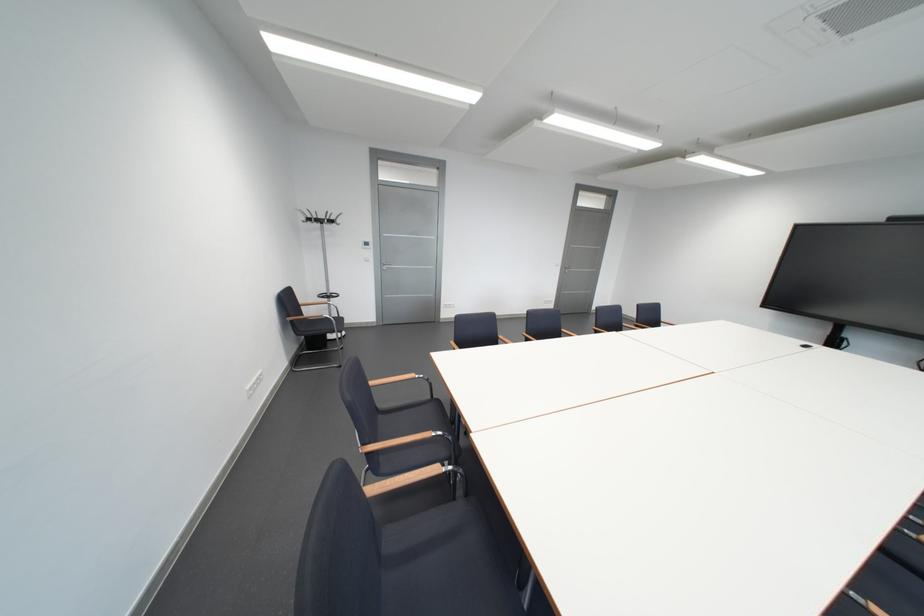
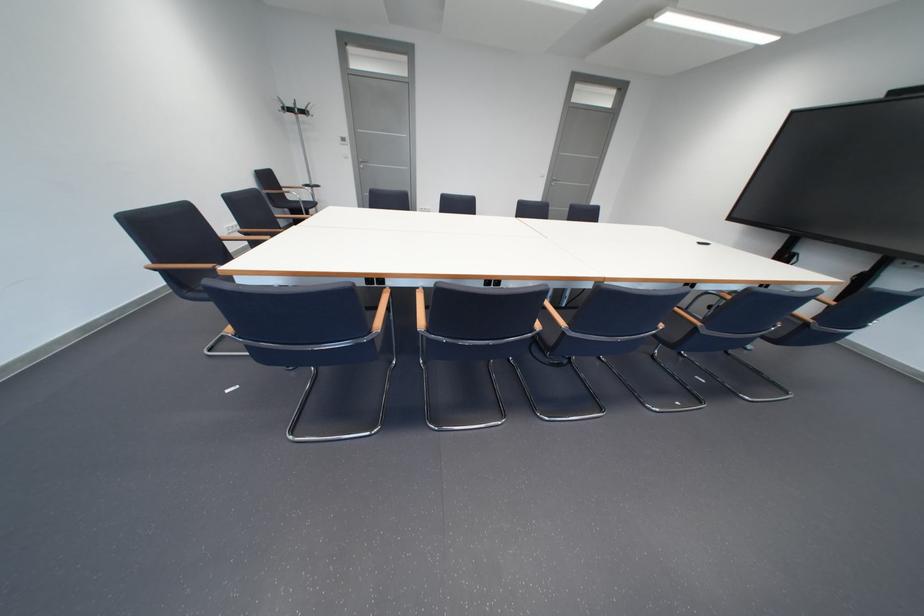
Find the pixel in the second image that matches (332,224) in the first image.

(304, 111)